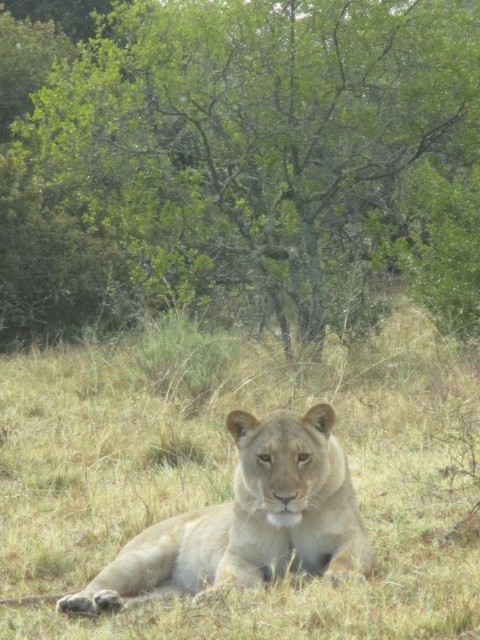
You are a park ranger planning to place a new bench in the savanna scene. The bench must be placed exactly 0.3 meters to the left of the green leafy tree at center. Where should you place the bench relative to the tree?

The bench should be placed 0.3 meters to the left of the green leafy tree at center, which is at point (x=240, y=164). Subtracting 0.3 meters from the x coordinate would give the bench position.

You are a safari guide leading a tour and notice the green leafy tree at center and the yellow dry grass at center. Which one is positioned to the right side from your perspective?

The green leafy tree at center is positioned to the right of the yellow dry grass at center, so the green leafy tree at center is on the right side.

You are a photographer trying to capture a wide shot of the lioness in the grassy savanna. You want to ensure both the green leafy tree at center and the yellow dry grass at center are in the frame. Based on their widths, which object might require you to adjust your camera angle to include its full size?

The green leafy tree at center might be wider than the yellow dry grass at center, so you might need to adjust your camera angle to ensure the tree is fully captured in the frame.